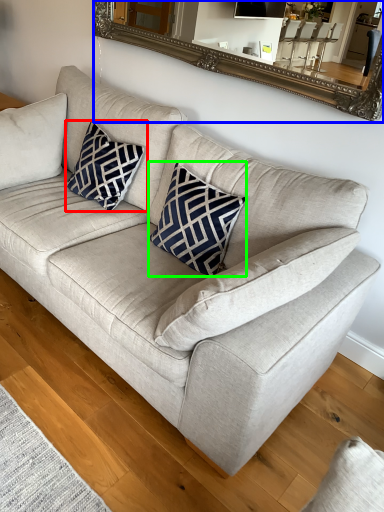
Question: Which is farther away from pillow (highlighted by a red box)? mirror (highlighted by a blue box) or throw pillow (highlighted by a green box)?

Choices:
 (A) mirror
 (B) throw pillow

Answer: (A)